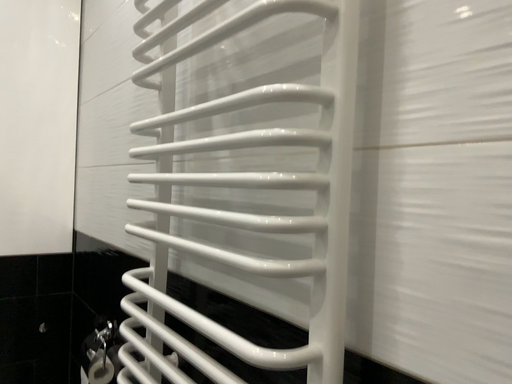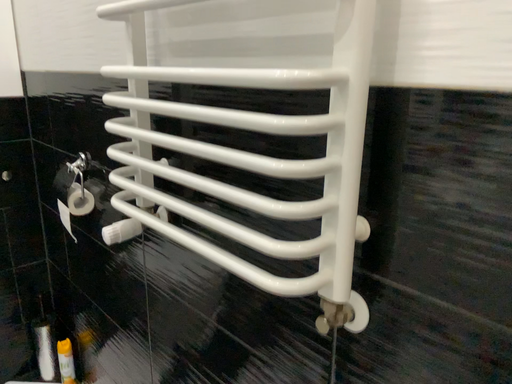
Question: How did the camera likely rotate when shooting the video?

Choices:
 (A) rotated left
 (B) rotated right

Answer: (B)